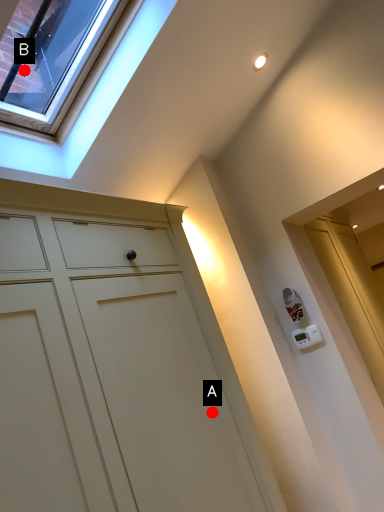
Question: Two points are circled on the image, labeled by A and B beside each circle. Which point appears closest to the camera in this image?

Choices:
 (A) A is closer
 (B) B is closer

Answer: (A)